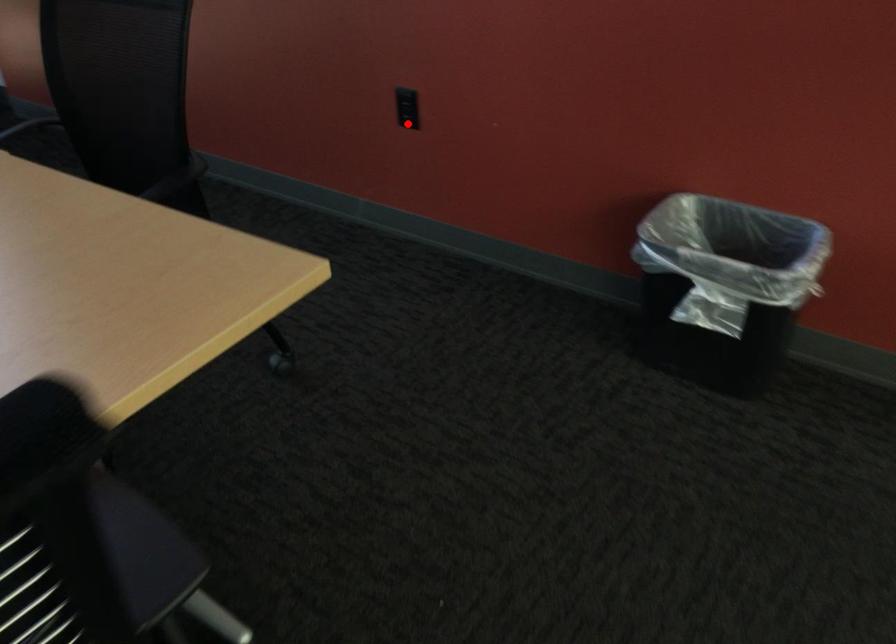
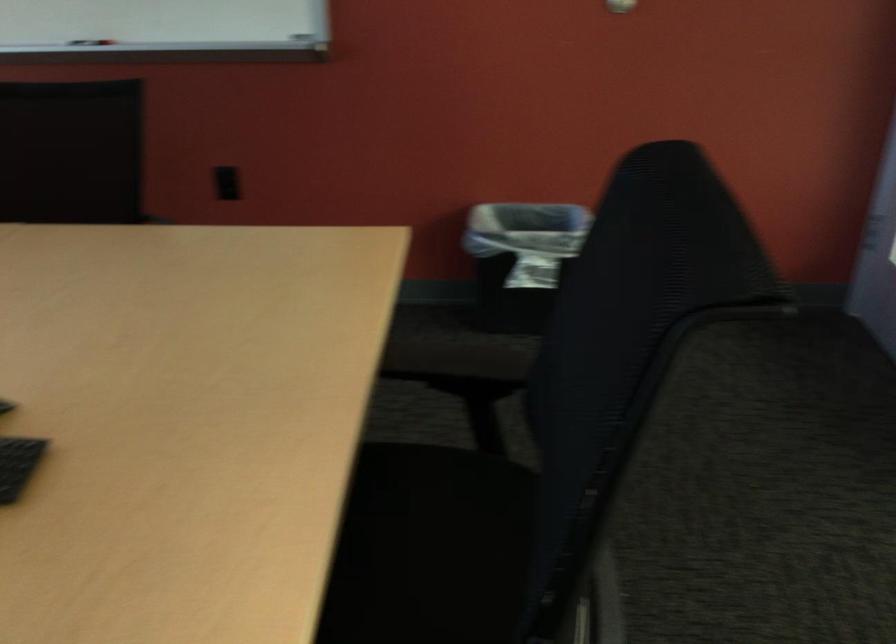
Question: I am providing you with two images of the same scene from different viewpoints. A red point is marked on the first image. Is the red point's position out of view in image 2?

Choices:
 (A) Yes
 (B) No

Answer: (B)